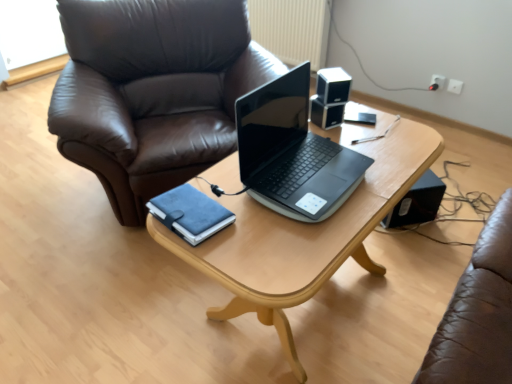
This screenshot has height=384, width=512. In order to click on free space in front of suede blue notebook at center in this screenshot , I will do `click(213, 254)`.